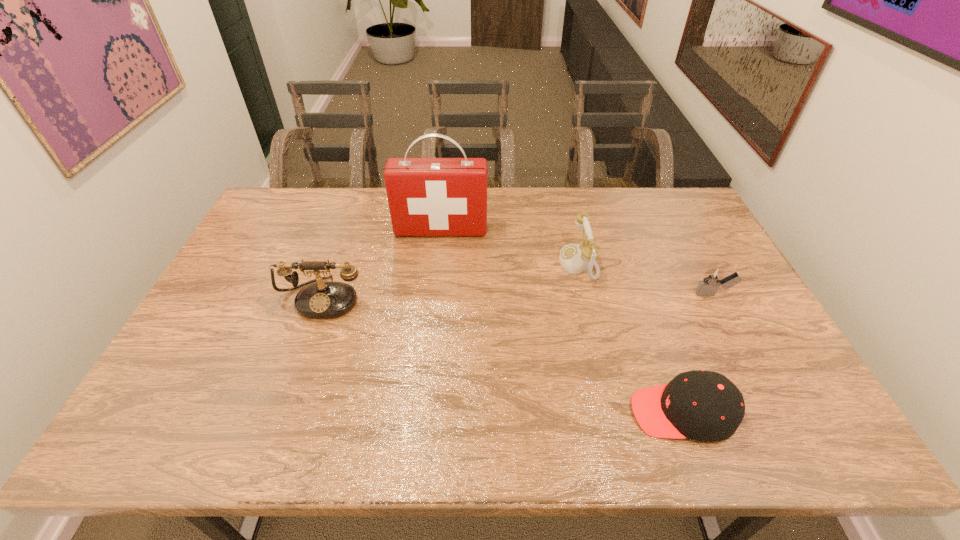
The width and height of the screenshot is (960, 540). In order to click on the second object from left to right in this screenshot , I will do `click(426, 196)`.

What are the coordinates of `the farthest object` in the screenshot? It's located at (426, 196).

Locate an element on the screen. the left telephone is located at coordinates (322, 300).

Locate an element on the screen. the shorter telephone is located at coordinates (574, 258).

At what (x,y) coordinates should I click in order to perform the action: click on the right telephone. Please return your answer as a coordinate pair (x, y). Looking at the image, I should click on 574,258.

Where is `the rightmost object`? The width and height of the screenshot is (960, 540). the rightmost object is located at coordinates (712, 279).

The width and height of the screenshot is (960, 540). I want to click on cap, so click(706, 406).

The height and width of the screenshot is (540, 960). In order to click on free space located 0.380m on the front face of the second object from left to right in this screenshot , I will do `click(431, 327)`.

Locate an element on the screen. This screenshot has height=540, width=960. free space located 0.130m on the dial of the left telephone is located at coordinates (301, 360).

Where is `free location located 0.200m on the dial of the third tallest object`? This screenshot has width=960, height=540. free location located 0.200m on the dial of the third tallest object is located at coordinates (495, 264).